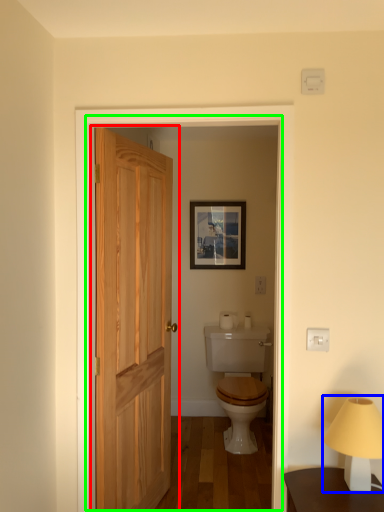
Question: Which object is the farthest from door (highlighted by a red box)? Choose among these: table lamp (highlighted by a blue box) or screen door (highlighted by a green box).

Choices:
 (A) table lamp
 (B) screen door

Answer: (A)